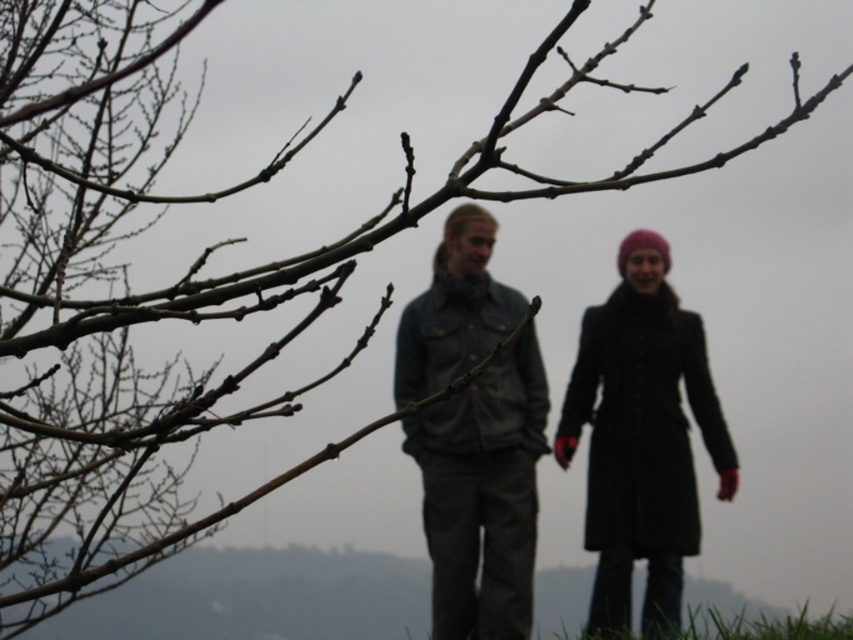
Question: Is denim jacket at center to the right of matte black coat at center from the viewer's perspective?

Choices:
 (A) yes
 (B) no

Answer: (B)

Question: Among these points, which one is nearest to the camera?

Choices:
 (A) (595, 634)
 (B) (467, 348)
 (C) (619, 244)

Answer: (A)

Question: Which point is closer to the camera?

Choices:
 (A) (836, 620)
 (B) (453, 220)

Answer: (A)

Question: Is denim jacket at center above matte black coat at center?

Choices:
 (A) no
 (B) yes

Answer: (B)

Question: Among these objects, which one is farthest from the camera?

Choices:
 (A) green grass at lower center
 (B) denim jacket at center
 (C) matte black coat at center

Answer: (C)

Question: Is matte black coat at center above green grass at lower center?

Choices:
 (A) no
 (B) yes

Answer: (B)